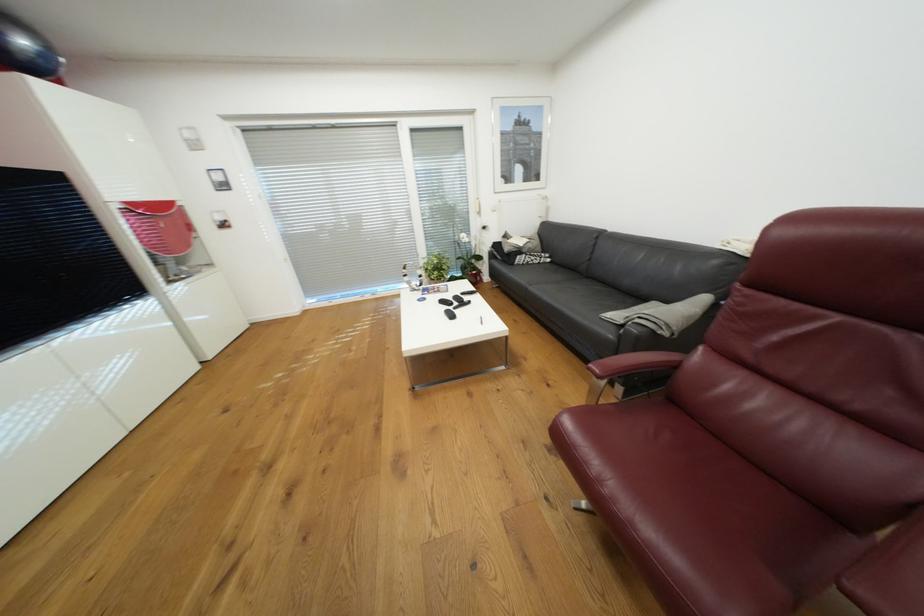
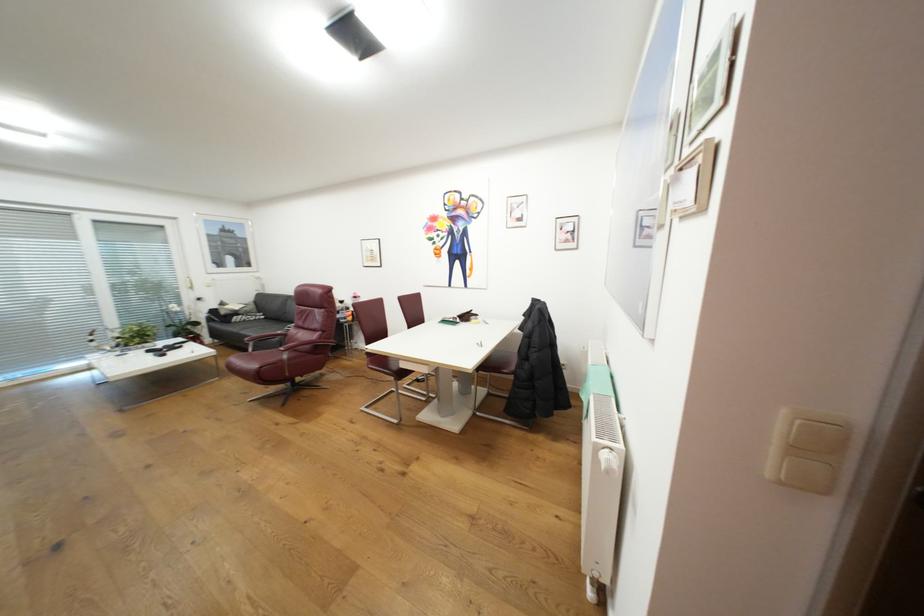
Where in the second image is the point corresponding to point (527, 259) from the first image?

(244, 318)